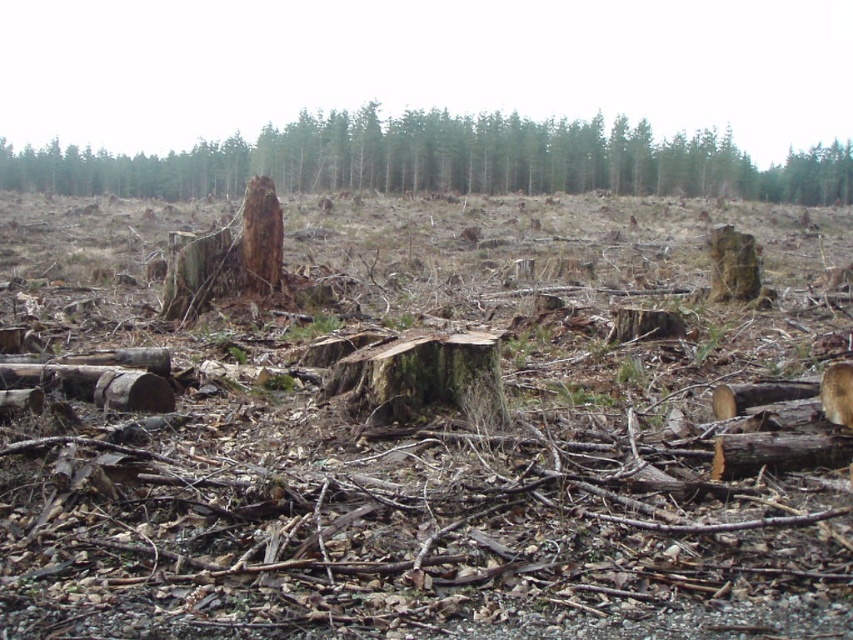
Question: Which point appears farthest from the camera in this image?

Choices:
 (A) (245, 280)
 (B) (228, 177)

Answer: (B)

Question: Does brown rough tree stump at center have a smaller size compared to brown rough tree trunk at center?

Choices:
 (A) yes
 (B) no

Answer: (B)

Question: Is brown rough tree stump at center to the left of brown rough tree trunk at center from the viewer's perspective?

Choices:
 (A) yes
 (B) no

Answer: (A)

Question: Is brown rough tree stump at center to the left of brown rough tree trunk at center from the viewer's perspective?

Choices:
 (A) no
 (B) yes

Answer: (B)